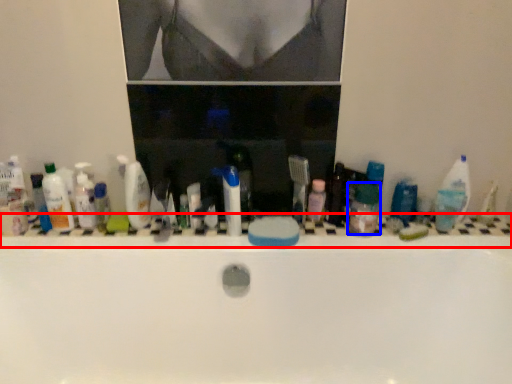
Question: Which point is closer to the camera, ledge (highlighted by a red box) or mouthwash (highlighted by a blue box)?

Choices:
 (A) ledge
 (B) mouthwash

Answer: (B)